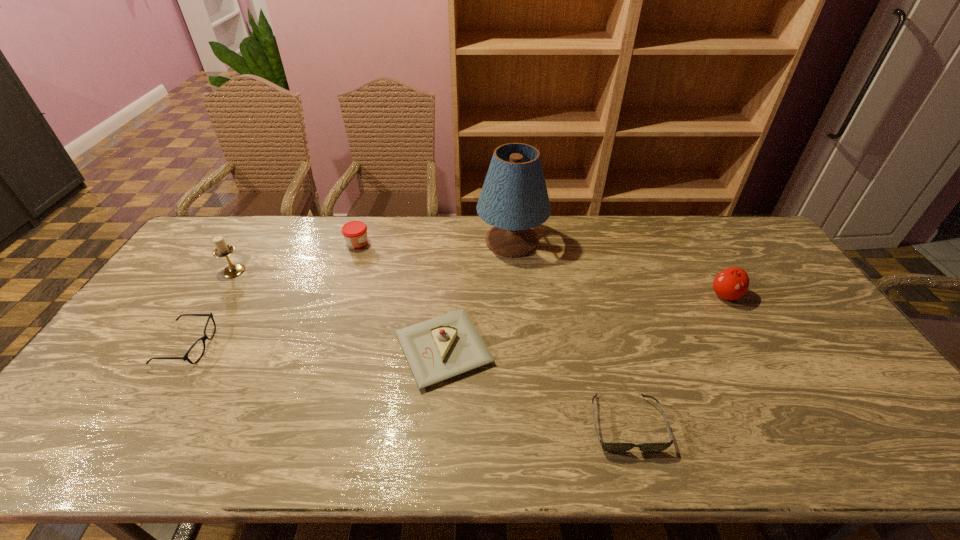
You are a GUI agent. You are given a task and a screenshot of the screen. Output one action in this format:
    pyautogui.click(x=<x>, y=<y>)
    Task: Click on the tallest object
    The width and height of the screenshot is (960, 540).
    Given the screenshot: What is the action you would take?
    pyautogui.click(x=514, y=198)

The width and height of the screenshot is (960, 540). In order to click on the sixth shortest object in this screenshot , I will do `click(222, 250)`.

The width and height of the screenshot is (960, 540). What are the coordinates of `apple` in the screenshot? It's located at (732, 283).

Locate an element on the screen. The image size is (960, 540). the rightmost object is located at coordinates (732, 283).

You are a GUI agent. You are given a task and a screenshot of the screen. Output one action in this format:
    pyautogui.click(x=<x>, y=<y>)
    Task: Click on the fifth object from right to left
    
    Given the screenshot: What is the action you would take?
    pyautogui.click(x=355, y=232)

This screenshot has width=960, height=540. I want to click on cake, so click(443, 347).

Image resolution: width=960 pixels, height=540 pixels. I want to click on spectacles, so click(205, 337).

The width and height of the screenshot is (960, 540). Find the location of `the nearest object`. the nearest object is located at coordinates (610, 447).

Locate an element on the screen. the shortest object is located at coordinates (610, 447).

At what (x,y) coordinates should I click in order to perform the action: click on free region located on the right of the lampshade. Please return your answer as a coordinate pair (x, y). The height and width of the screenshot is (540, 960). Looking at the image, I should click on (657, 241).